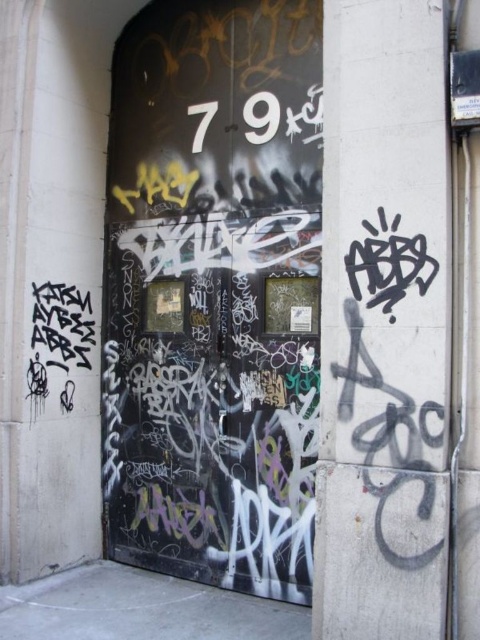
You are a painter who needs to decide whether to paint the black textured door at center or the grungy concrete pillar at center first. Based on their heights, which one should you tackle first?

The black textured door at center is taller than the grungy concrete pillar at center, so you should paint the black textured door at center first.

You are standing in front of a heavily graffitied door with two small rectangular windows near its center. There is a point at coordinates point [214,292]. Which object is this point located on?

The point [214,292] is located on the black textured door at center.

You are a painter who wants to cover the black textured door at center and the grungy concrete pillar at center with a fresh coat of paint. If you have a limited amount of paint, which object should you prioritize painting first based on their sizes?

The black textured door at center has a larger size compared to the grungy concrete pillar at center, so you should prioritize painting the black textured door at center first to ensure you have enough paint for the larger surface area.